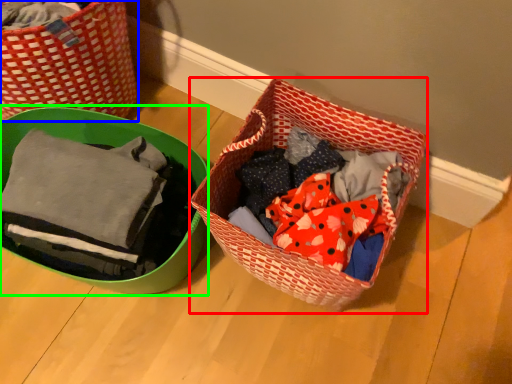
Question: Based on their relative distances, which object is farther from picnic basket (highlighted by a red box)? Choose from picnic basket (highlighted by a blue box) and gift basket (highlighted by a green box).

Choices:
 (A) picnic basket
 (B) gift basket

Answer: (A)